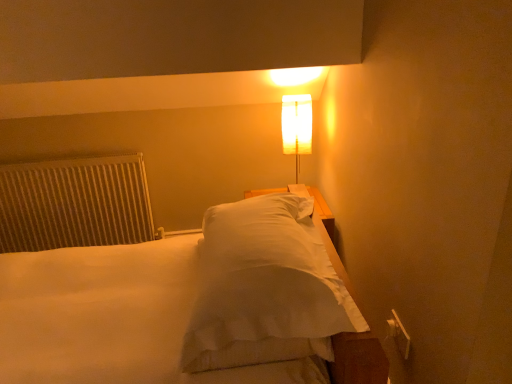
Question: Considering the relative positions of white fabric lamp at upper center and white soft bed at center in the image provided, is white fabric lamp at upper center to the left or to the right of white soft bed at center?

Choices:
 (A) left
 (B) right

Answer: (B)

Question: Does point (309, 100) appear closer or farther from the camera than point (54, 263)?

Choices:
 (A) farther
 (B) closer

Answer: (A)

Question: Which object is the farthest from the white fabric lamp at upper center?

Choices:
 (A) white textured radiator at left
 (B) white soft bed at center

Answer: (A)

Question: Considering the real-world distances, which object is farthest from the white fabric lamp at upper center?

Choices:
 (A) white soft bed at center
 (B) white textured radiator at left

Answer: (B)